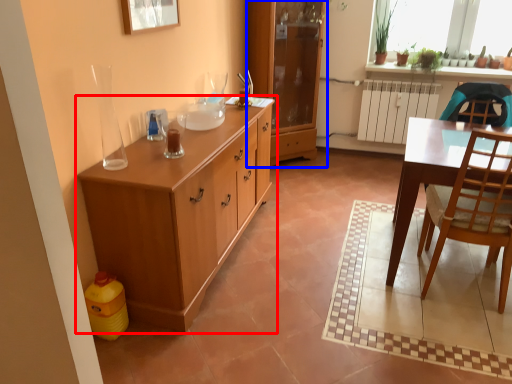
Question: Which object appears closest to the camera in this image, cabinetry (highlighted by a red box) or cabinetry (highlighted by a blue box)?

Choices:
 (A) cabinetry
 (B) cabinetry

Answer: (A)